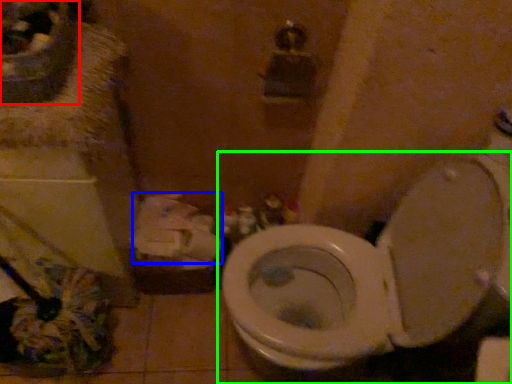
Question: Based on their relative distances, which object is farther from sink (highlighted by a red box)? Choose from toilet paper (highlighted by a blue box) and toilet (highlighted by a green box).

Choices:
 (A) toilet paper
 (B) toilet

Answer: (B)